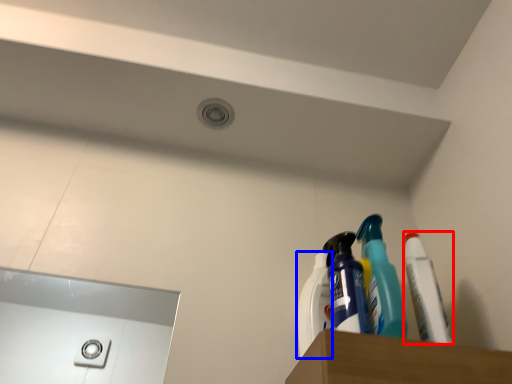
Question: Which of the following is the closest to the observer, toothpaste (highlighted by a red box) or cleaning product (highlighted by a blue box)?

Choices:
 (A) toothpaste
 (B) cleaning product

Answer: (A)